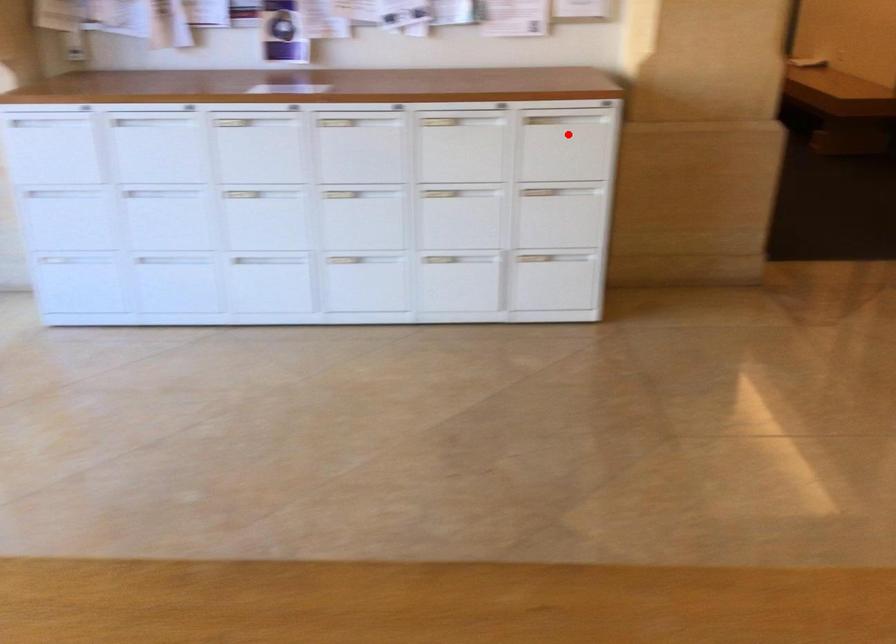
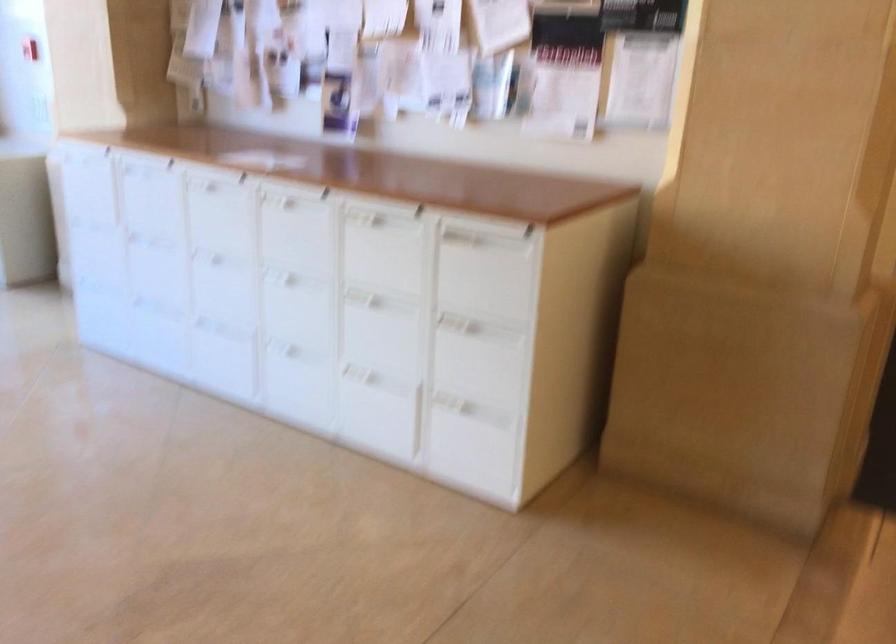
Where in the second image is the point corresponding to the highlighted location from the first image?

(487, 269)